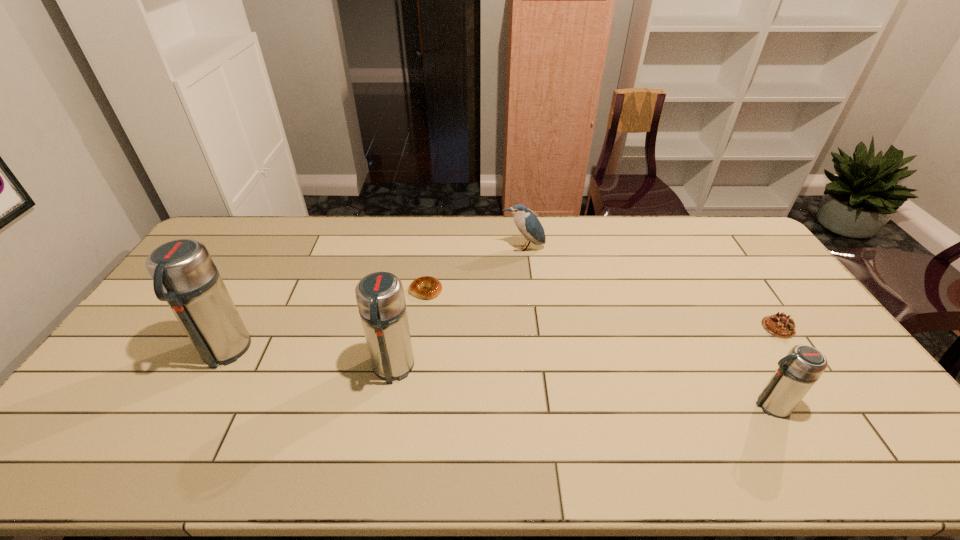
Locate an element on the screen. The height and width of the screenshot is (540, 960). the leftmost object is located at coordinates (184, 275).

Where is `the second tallest object`? This screenshot has width=960, height=540. the second tallest object is located at coordinates (380, 297).

I want to click on the second tallest thermos bottle, so click(380, 297).

The height and width of the screenshot is (540, 960). Find the location of `the nearest thermos bottle`. the nearest thermos bottle is located at coordinates (798, 371).

At what (x,y) coordinates should I click in order to perform the action: click on the nearest object. Please return your answer as a coordinate pair (x, y). The width and height of the screenshot is (960, 540). Looking at the image, I should click on (798, 371).

You are a GUI agent. You are given a task and a screenshot of the screen. Output one action in this format:
    pyautogui.click(x=<x>, y=<y>)
    Task: Click on the farthest object
    The height and width of the screenshot is (540, 960).
    Given the screenshot: What is the action you would take?
    pyautogui.click(x=527, y=223)

Locate an element on the screen. the third object from right to left is located at coordinates (527, 223).

Where is `bagel`? This screenshot has width=960, height=540. bagel is located at coordinates (433, 287).

Where is `the fifth nearest object`? The width and height of the screenshot is (960, 540). the fifth nearest object is located at coordinates (433, 287).

Find the location of a particular element. This screenshot has width=960, height=540. the rightmost object is located at coordinates (779, 325).